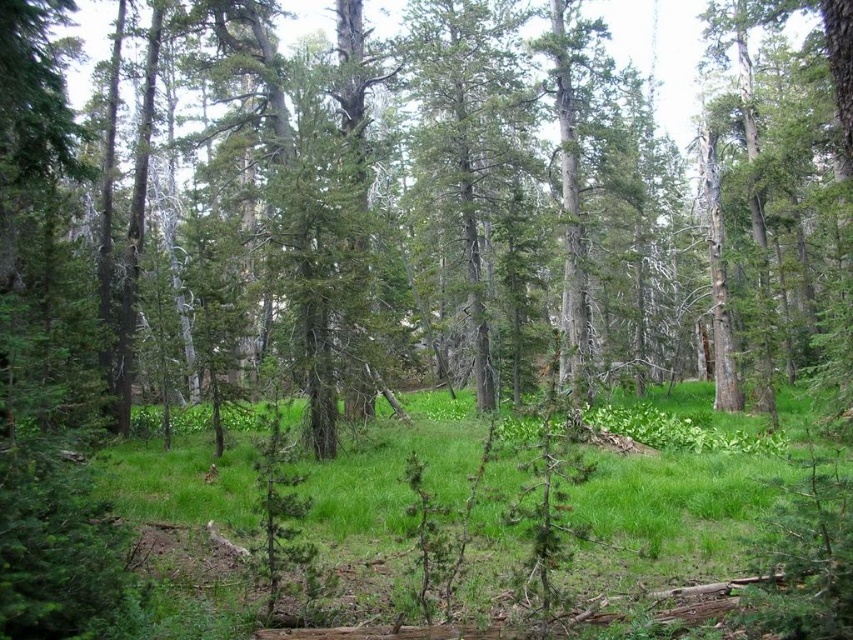
Can you confirm if green leafy tree at center is shorter than green grassy area at center?

No, green leafy tree at center is not shorter than green grassy area at center.

Is the position of green leafy tree at center more distant than that of green grassy area at center?

No.

What do you see at coordinates (534, 188) in the screenshot? I see `green leafy tree at center` at bounding box center [534, 188].

At what (x,y) coordinates should I click in order to perform the action: click on green leafy tree at center. Please return your answer as a coordinate pair (x, y). Looking at the image, I should click on (534, 188).